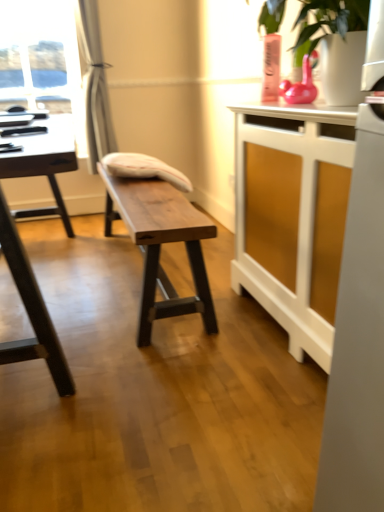
At what (x,y) coordinates should I click in order to perform the action: click on vacant space in front of white wood cabinet at right, the 1th table positioned from the right. Please return your answer as a coordinate pair (x, y). Image resolution: width=384 pixels, height=512 pixels. Looking at the image, I should click on (247, 418).